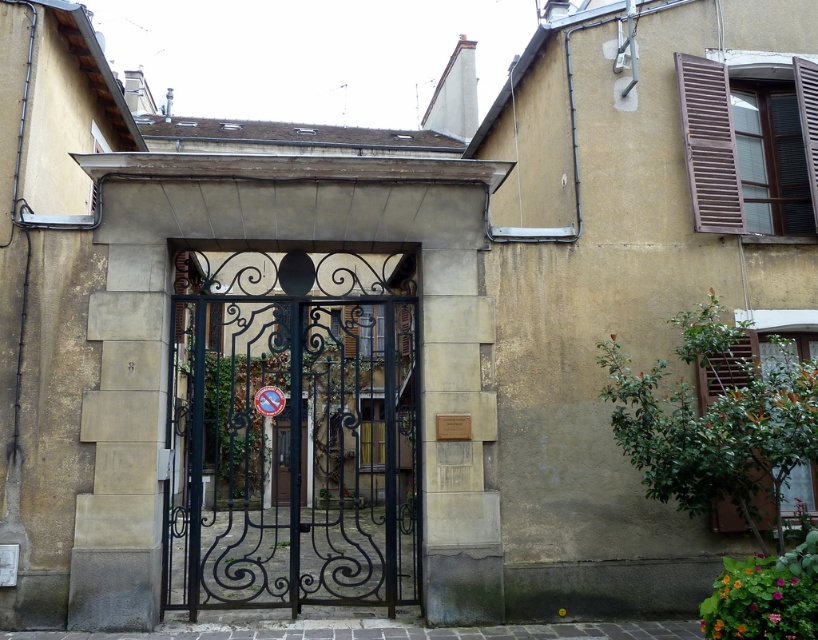
Question: In this image, where is black wrought iron gate at center located relative to brown wooden shutters at upper right?

Choices:
 (A) right
 (B) left

Answer: (B)

Question: Considering the relative positions of black wrought iron gate at center and brown wooden shutters at upper right in the image provided, where is black wrought iron gate at center located with respect to brown wooden shutters at upper right?

Choices:
 (A) right
 (B) left

Answer: (B)

Question: Is black wrought iron gate at center further to the viewer compared to brown wooden shutters at upper right?

Choices:
 (A) no
 (B) yes

Answer: (A)

Question: Which point is closer to the camera?

Choices:
 (A) brown wooden shutters at upper right
 (B) black wrought iron gate at center

Answer: (B)

Question: Which of the following is the farthest from the observer?

Choices:
 (A) (405, 493)
 (B) (703, 189)

Answer: (A)